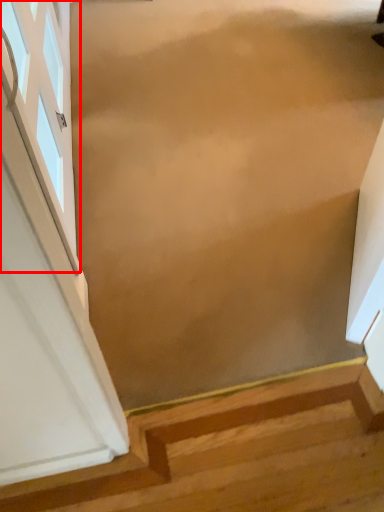
Question: From the image's perspective, considering the relative positions of window (annotated by the red box) and stairs in the image provided, where is window (annotated by the red box) located with respect to the staircase?

Choices:
 (A) below
 (B) above

Answer: (B)